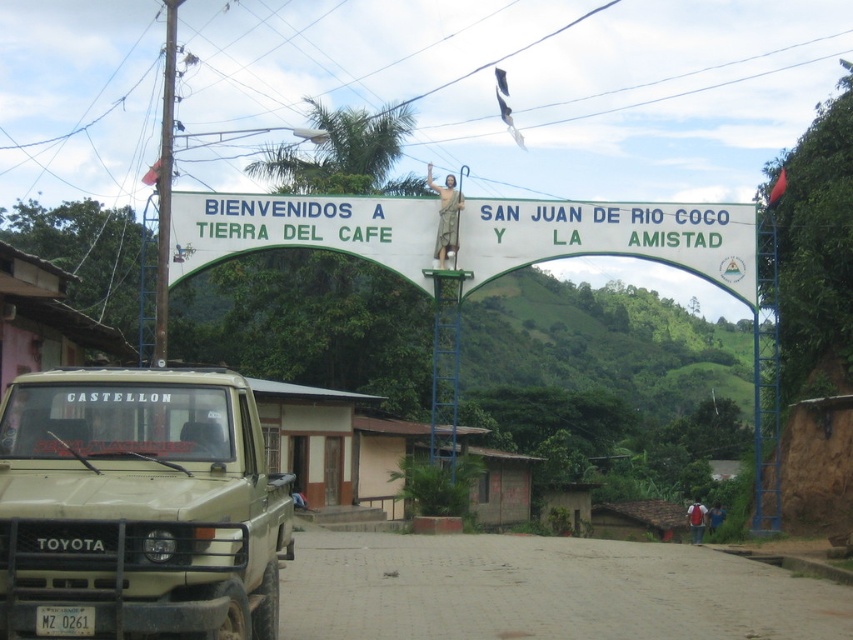
Question: In this image, where is beige matte truck at lower left located relative to white painted wood sign at center?

Choices:
 (A) below
 (B) above

Answer: (A)

Question: Can you confirm if beige matte truck at lower left is smaller than white painted wood sign at center?

Choices:
 (A) no
 (B) yes

Answer: (B)

Question: Which point is closer to the camera?

Choices:
 (A) (165, 525)
 (B) (664, 205)

Answer: (A)

Question: Which point is closer to the camera?

Choices:
 (A) white painted wood sign at center
 (B) beige matte truck at lower left

Answer: (B)

Question: Does beige matte truck at lower left have a lesser width compared to white painted wood sign at center?

Choices:
 (A) no
 (B) yes

Answer: (B)

Question: Among these points, which one is nearest to the camera?

Choices:
 (A) (236, 560)
 (B) (643, 241)

Answer: (A)